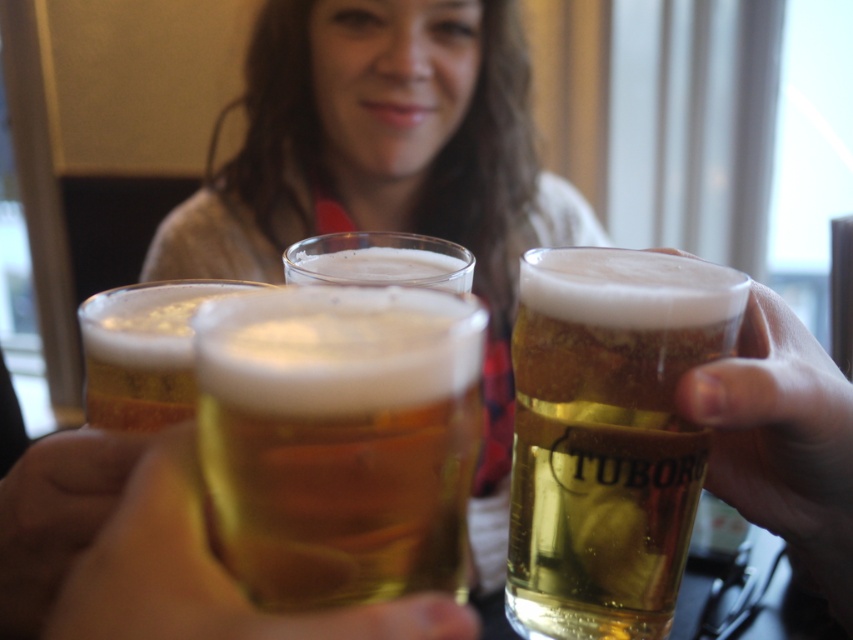
You are at a bar and want to grab the golden glass mug at center and the translucent glass mug at right. Which one is closer to your hand if you reach straight down?

The translucent glass mug at right is closer to your hand if you reach straight down because it is below the golden glass mug at center.

You are at a bar and want to choose a glass for your drink. The bartender mentions that the golden glass mug at center is shorter than the translucent glass mug at right. Which glass would you choose if you want a taller glass?

You should choose the translucent glass mug at right because it is taller than the golden glass mug at center.

You are a bartender who needs to place two glasses on a shelf that is 10 inches wide. The glasses are at point (670, 397). Can you fit both glasses on the shelf without overlapping?

The two glasses at point (670, 397) are 10.15 inches apart. Since the shelf is only 10 inches wide, they cannot be placed without overlapping as the required space exceeds the shelf width.